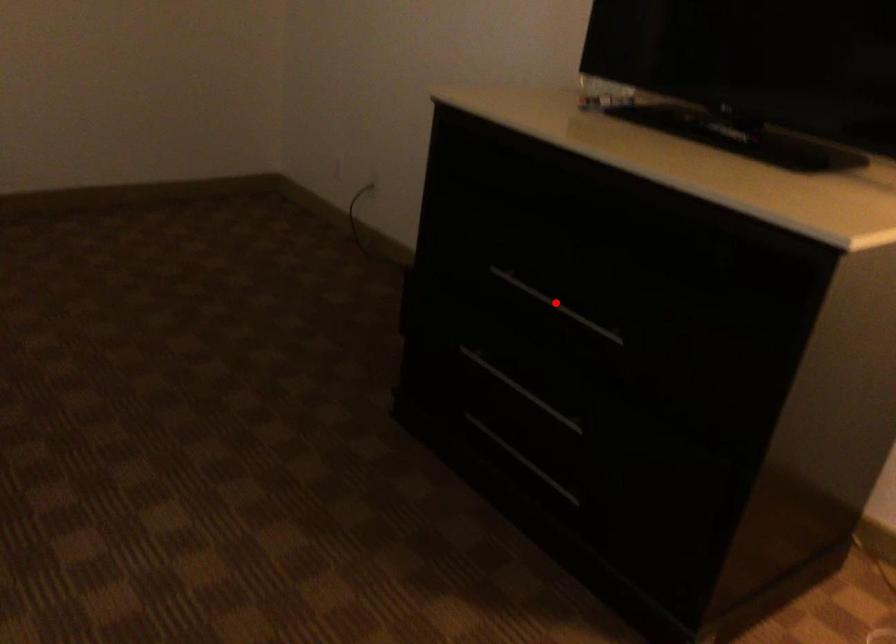
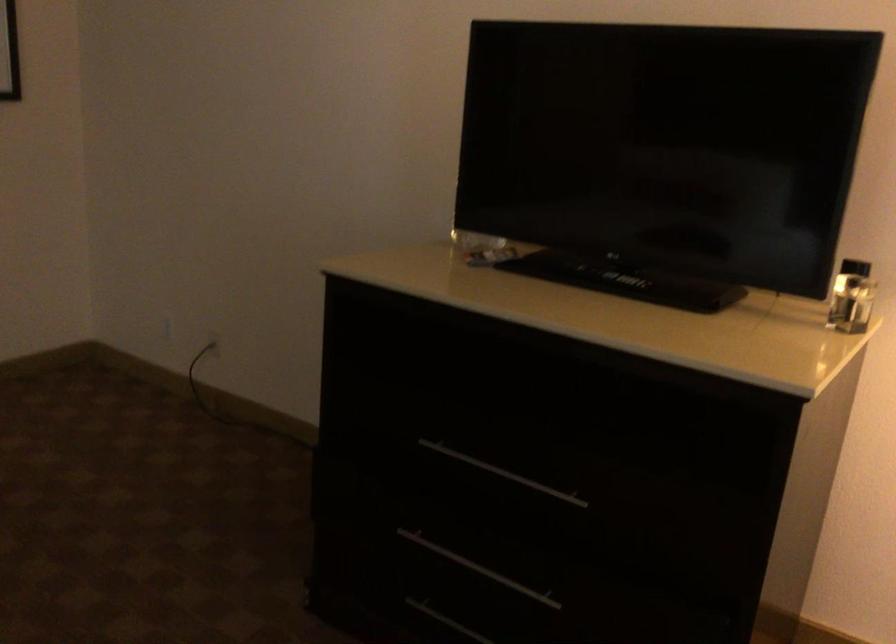
The point at the highlighted location is marked in the first image. Where is the corresponding point in the second image?

(502, 473)